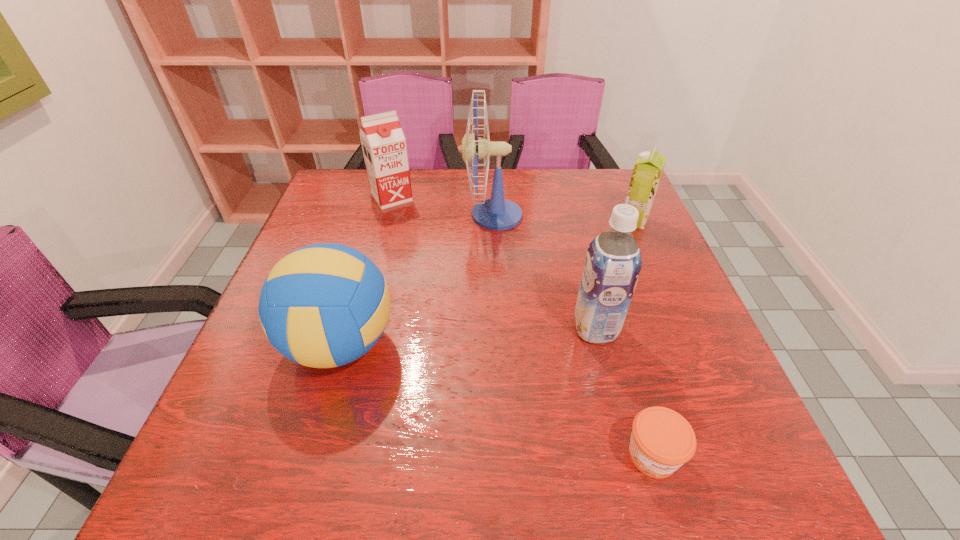
Find the location of a particular element. fan is located at coordinates (497, 213).

Locate an element on the screen. the nearest soya milk is located at coordinates (613, 261).

This screenshot has height=540, width=960. Find the location of `the second soya milk from right to left`. the second soya milk from right to left is located at coordinates (613, 261).

Find the location of a particular element. Image resolution: width=960 pixels, height=540 pixels. the farthest soya milk is located at coordinates (384, 148).

I want to click on the second tallest soya milk, so 384,148.

Locate an element on the screen. volleyball is located at coordinates (325, 305).

Locate an element on the screen. the rightmost soya milk is located at coordinates (649, 166).

The image size is (960, 540). Find the location of `the second farthest soya milk`. the second farthest soya milk is located at coordinates (649, 166).

The image size is (960, 540). In order to click on the shortest object in this screenshot , I will do `click(662, 440)`.

At what (x,y) coordinates should I click in order to perform the action: click on the nearest object. Please return your answer as a coordinate pair (x, y). The image size is (960, 540). Looking at the image, I should click on (662, 440).